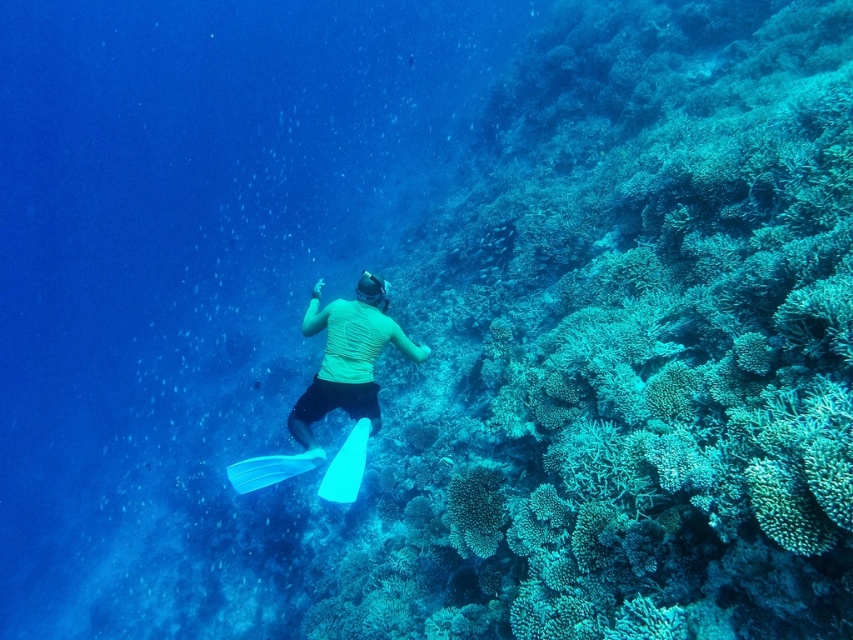
Can you confirm if yellow matte shirt at center is shorter than green textured coral at center?

No.

I want to click on yellow matte shirt at center, so click(x=347, y=356).

Identify the location of yellow matte shirt at center. The image size is (853, 640). (347, 356).

This screenshot has height=640, width=853. What do you see at coordinates (474, 512) in the screenshot? I see `green textured coral at center` at bounding box center [474, 512].

Can you confirm if green textured coral at center is positioned below translucent plastic paddle at lower center?

Actually, green textured coral at center is above translucent plastic paddle at lower center.

Locate an element on the screen. The height and width of the screenshot is (640, 853). green textured coral at center is located at coordinates (474, 512).

Is point (784, 385) positioned behind point (256, 461)?

That is False.

Which is behind, point (704, 212) or point (297, 456)?

The point (297, 456) is behind.

Locate an element on the screen. This screenshot has width=853, height=640. green textured coral reef at center is located at coordinates (631, 346).